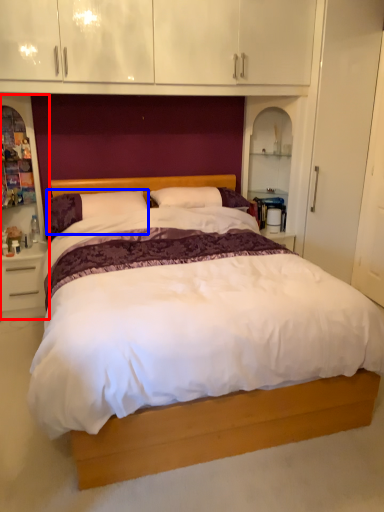
Question: Which object appears closest to the camera in this image, dresser (highlighted by a red box) or pillow (highlighted by a blue box)?

Choices:
 (A) dresser
 (B) pillow

Answer: (A)